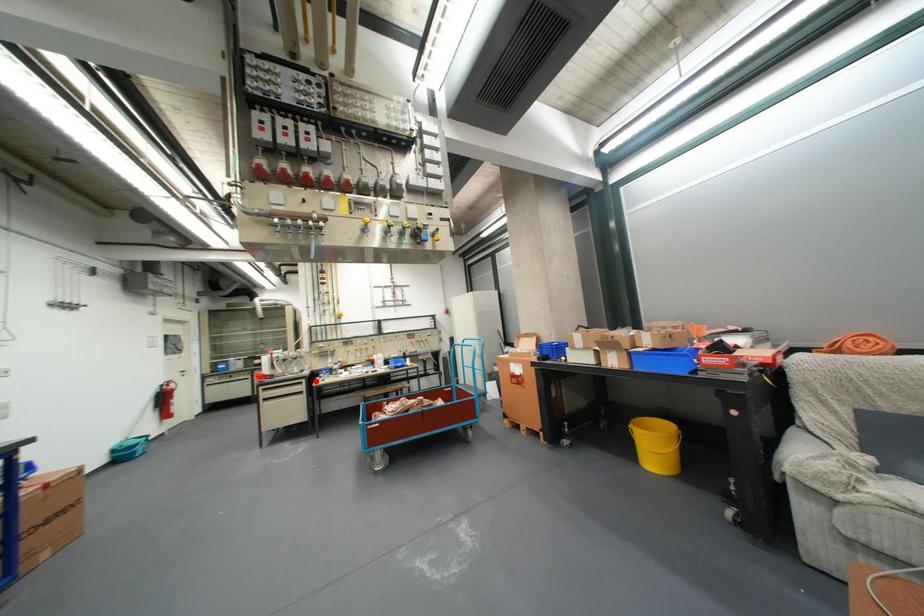
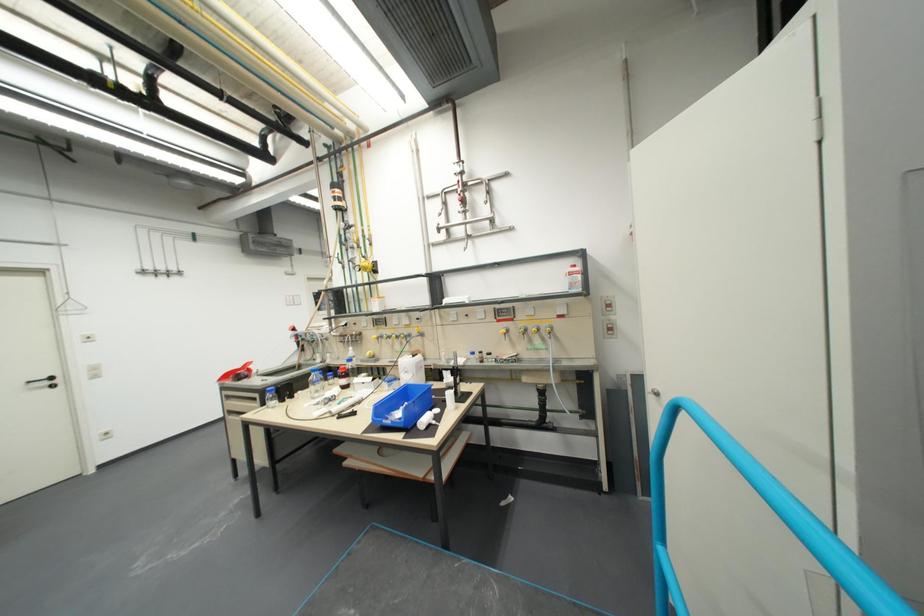
Locate, in the second image, the point that corresponds to the highlighted location in the first image.

(269, 397)